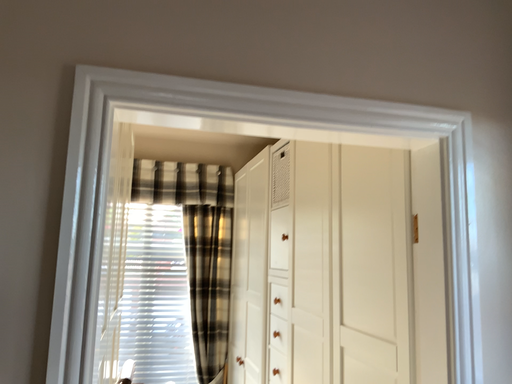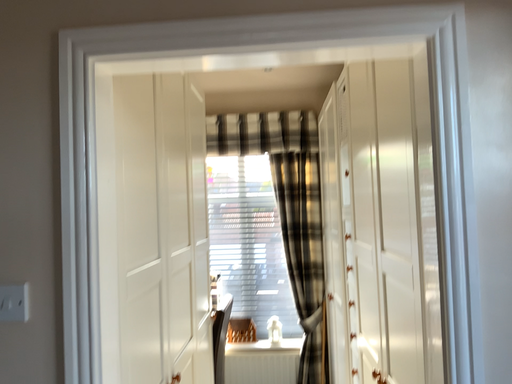
Question: How did the camera likely rotate when shooting the video?

Choices:
 (A) rotated upward
 (B) rotated downward

Answer: (B)